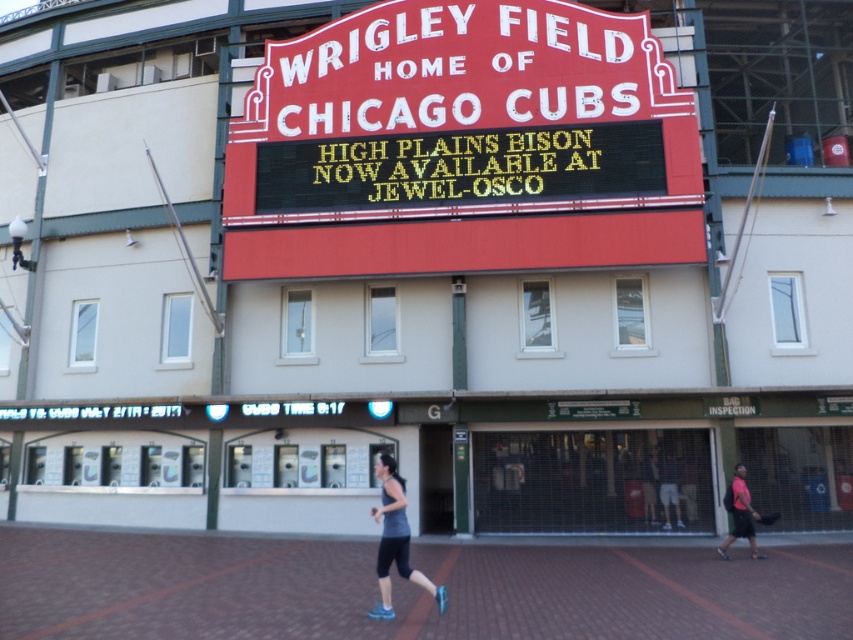
You are a photographer standing in front of Wrigley Field. You notice a gray fabric tank top at center and a pink fabric shorts at lower right in your viewfinder. Which clothing item is closer to the camera?

The gray fabric tank top at center is closer to the camera because it is positioned over the pink fabric shorts at lower right.

You are a visitor at Wrigley Field and want to read the message on the gray fabric tank top at center. Can you see it clearly from your current position in front of the black electronic display at center?

The gray fabric tank top at center is behind the black electronic display at center, so you cannot see it clearly from your current position in front of the black electronic display at center.